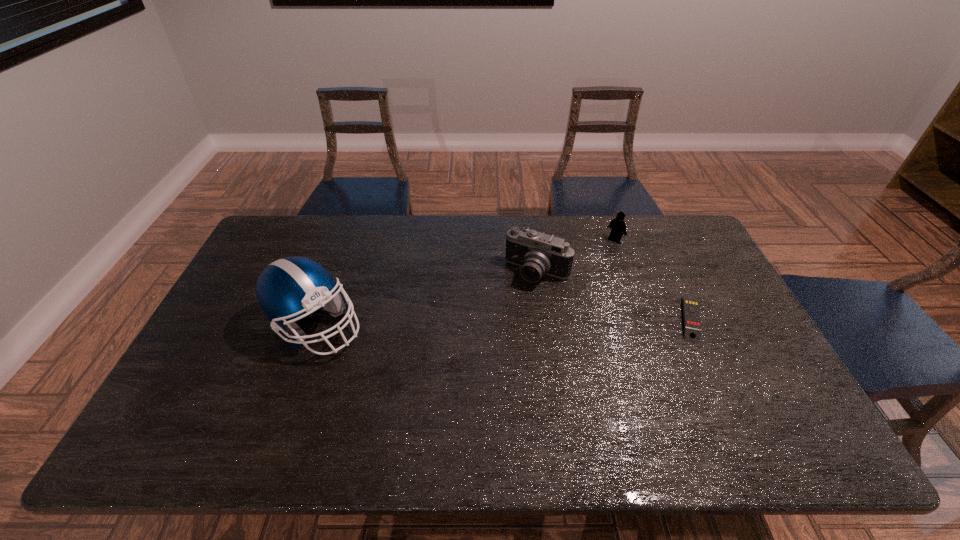
Where is `free space between the tallest object and the third object from left to right`? free space between the tallest object and the third object from left to right is located at coordinates (466, 282).

Locate an element on the screen. free spot between the tallest object and the third object from left to right is located at coordinates (466, 282).

Image resolution: width=960 pixels, height=540 pixels. In order to click on free area in between the shortest object and the second tallest object in this screenshot , I will do `click(613, 296)`.

Locate an element on the screen. empty location between the camera and the farthest object is located at coordinates (576, 255).

You are a GUI agent. You are given a task and a screenshot of the screen. Output one action in this format:
    pyautogui.click(x=<x>, y=<y>)
    Task: Click on the free spot between the second shortest object and the third object from right to left
    Image resolution: width=960 pixels, height=540 pixels.
    Given the screenshot: What is the action you would take?
    pyautogui.click(x=576, y=255)

Locate an element on the screen. The height and width of the screenshot is (540, 960). free space that is in between the Lego and the camera is located at coordinates (576, 255).

Choose which object is the second nearest neighbor to the second farthest object. Please provide its 2D coordinates. Your answer should be formatted as a tuple, i.e. [(x, y)], where the tuple contains the x and y coordinates of a point satisfying the conditions above.

[(692, 326)]

Find the location of a particular element. This screenshot has height=540, width=960. object that stands as the second closest to the second object from right to left is located at coordinates (692, 326).

Find the location of a particular element. free space that satisfies the following two spatial constraints: 1. on the front side of the shortest object; 2. on the left side of the Lego is located at coordinates [644, 319].

Where is `vacant space that satisfies the following two spatial constraints: 1. on the front side of the third tallest object; 2. on the left side of the rightmost object`? vacant space that satisfies the following two spatial constraints: 1. on the front side of the third tallest object; 2. on the left side of the rightmost object is located at coordinates (644, 319).